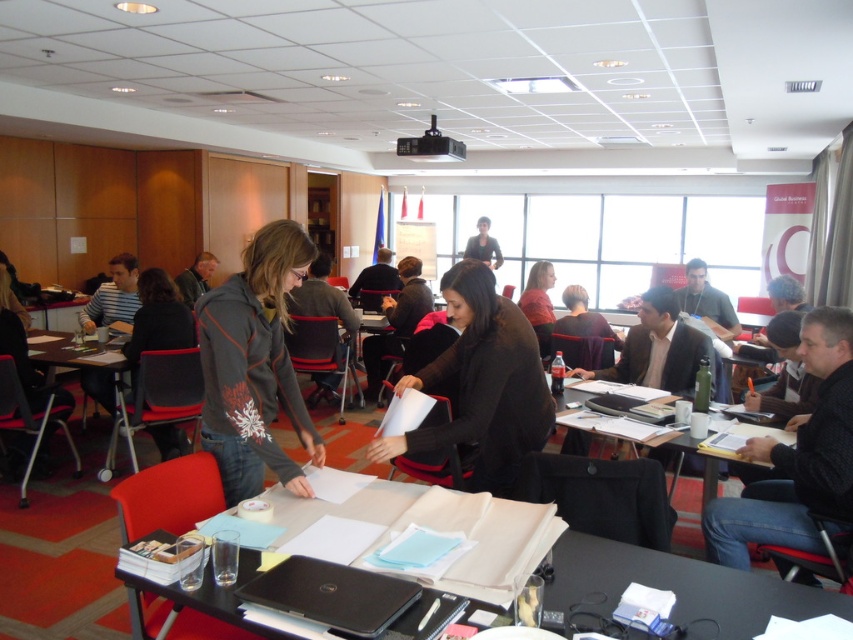
Question: Is black matte jacket at center below wooden table at left?

Choices:
 (A) yes
 (B) no

Answer: (B)

Question: Where is dark gray hoodie at center located in relation to black matte jacket at center in the image?

Choices:
 (A) left
 (B) right

Answer: (A)

Question: Can you confirm if black matte jacket at center is positioned above wooden table at left?

Choices:
 (A) no
 (B) yes

Answer: (B)

Question: Which point is closer to the camera?

Choices:
 (A) black matte jacket at center
 (B) black plastic table at center
 (C) dark gray hoodie at center

Answer: (B)

Question: Which object is the closest to the black plastic table at center?

Choices:
 (A) black matte jacket at center
 (B) dark gray hoodie at center
 (C) wooden table at left

Answer: (A)

Question: Which object is positioned closest to the black matte jacket at center?

Choices:
 (A) wooden table at left
 (B) black plastic table at center

Answer: (B)